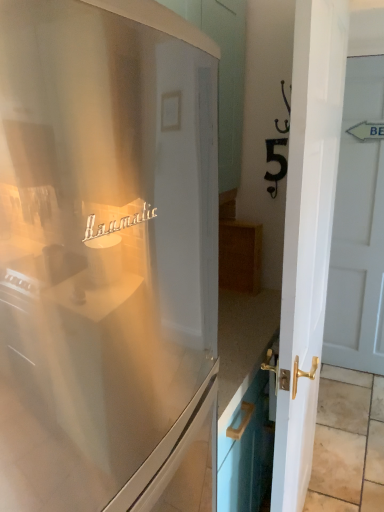
Question: Considering the relative positions of satin white refrigerator at center and white glossy door at right, the second door in the right-to-left sequence, in the image provided, is satin white refrigerator at center to the left of white glossy door at right, the second door in the right-to-left sequence, from the viewer's perspective?

Choices:
 (A) yes
 (B) no

Answer: (A)

Question: Does satin white refrigerator at center contain white glossy door at right, which is the 2th door from back to front?

Choices:
 (A) no
 (B) yes

Answer: (A)

Question: Can we say satin white refrigerator at center lies outside white glossy door at right, which is counted as the first door, starting from the left?

Choices:
 (A) no
 (B) yes

Answer: (B)

Question: Does satin white refrigerator at center have a lesser height compared to white glossy door at right, which is the 2th door from back to front?

Choices:
 (A) no
 (B) yes

Answer: (B)

Question: Can you confirm if satin white refrigerator at center is positioned to the right of white glossy door at right, which is counted as the first door, starting from the left?

Choices:
 (A) no
 (B) yes

Answer: (A)

Question: In the image, is white glossy door at right, which is the 2th door from front to back, on the left side or the right side of white glossy door at right, the second door in the right-to-left sequence?

Choices:
 (A) left
 (B) right

Answer: (B)

Question: Considering the positions of white glossy door at right, which is the 2th door from front to back, and white glossy door at right, placed as the 1th door when sorted from front to back, in the image, is white glossy door at right, which is the 2th door from front to back, taller or shorter than white glossy door at right, placed as the 1th door when sorted from front to back,?

Choices:
 (A) tall
 (B) short

Answer: (A)

Question: Is white glossy door at right, the 1th door in the right-to-left sequence, bigger or smaller than white glossy door at right, the second door in the right-to-left sequence?

Choices:
 (A) big
 (B) small

Answer: (B)

Question: Do you think white glossy door at right, which appears as the 1th door when viewed from the back, is within white glossy door at right, the second door in the right-to-left sequence, or outside of it?

Choices:
 (A) inside
 (B) outside

Answer: (B)

Question: From their relative heights in the image, would you say white glossy door at right, the second door in the right-to-left sequence, is taller or shorter than satin white refrigerator at center?

Choices:
 (A) tall
 (B) short

Answer: (A)

Question: Is white glossy door at right, the second door in the right-to-left sequence, to the left or to the right of satin white refrigerator at center in the image?

Choices:
 (A) left
 (B) right

Answer: (B)

Question: From a real-world perspective, is white glossy door at right, which is counted as the first door, starting from the left, physically located above or below satin white refrigerator at center?

Choices:
 (A) below
 (B) above

Answer: (A)

Question: Is point (344, 27) closer or farther from the camera than point (145, 380)?

Choices:
 (A) closer
 (B) farther

Answer: (B)

Question: From a real-world perspective, is white glossy door at right, which appears as the 1th door when viewed from the back, physically located above or below satin white refrigerator at center?

Choices:
 (A) above
 (B) below

Answer: (B)

Question: In terms of size, does white glossy door at right, acting as the second door starting from the left, appear bigger or smaller than satin white refrigerator at center?

Choices:
 (A) big
 (B) small

Answer: (B)